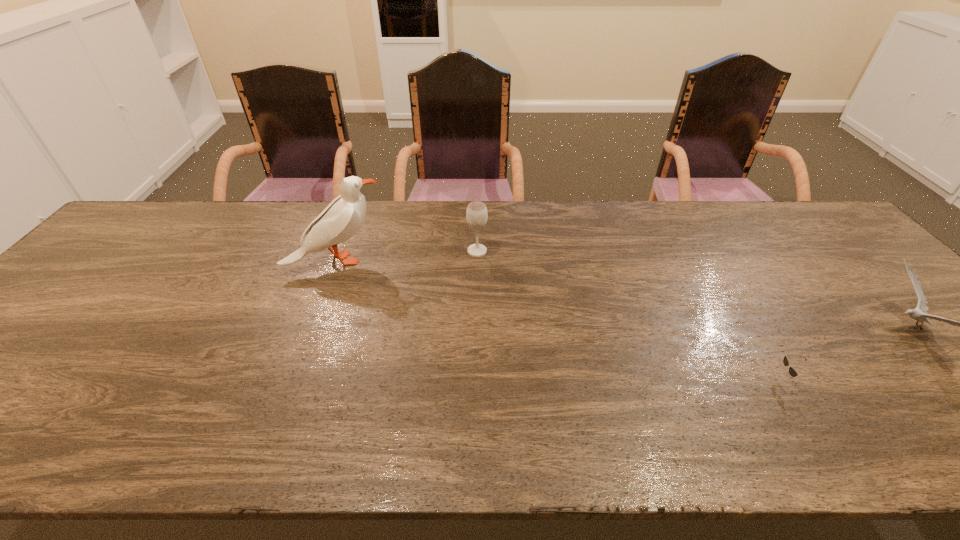
This screenshot has width=960, height=540. Identify the location of free space between the wineglass and the second object from right to left. point(635,315).

Where is `the third closest object to the second object from left to right`? The image size is (960, 540). the third closest object to the second object from left to right is located at coordinates (920, 314).

Select which object is the closest to the wineglass. Please provide its 2D coordinates. Your answer should be formatted as a tuple, i.e. [(x, y)], where the tuple contains the x and y coordinates of a point satisfying the conditions above.

[(343, 217)]

Locate an element on the screen. free point that satisfies the following two spatial constraints: 1. on the front side of the third shortest object; 2. at the beak of the tallest object is located at coordinates (477, 260).